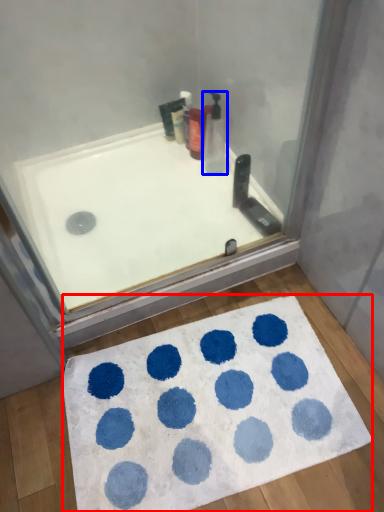
Question: Among these objects, which one is farthest to the camera, bath mat (highlighted by a red box) or cleaning product (highlighted by a blue box)?

Choices:
 (A) bath mat
 (B) cleaning product

Answer: (B)